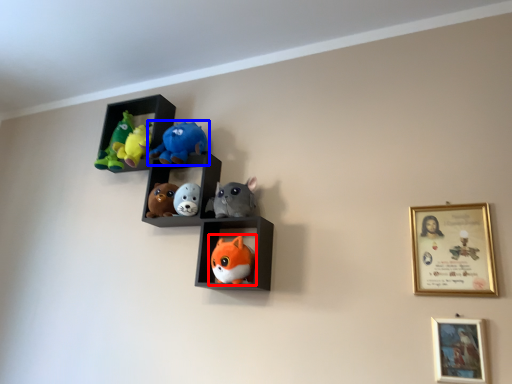
Question: Among these objects, which one is farthest to the camera, toy (highlighted by a red box) or toy (highlighted by a blue box)?

Choices:
 (A) toy
 (B) toy

Answer: (B)